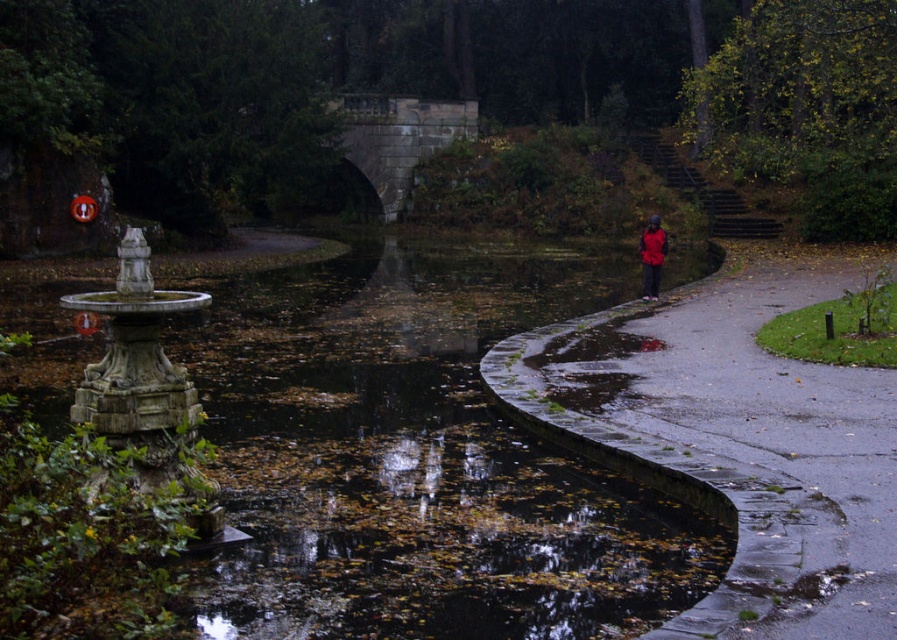
You are a delivery person carrying a package and need to walk along the smooth asphalt path at right while avoiding stepping on the red matte jacket at right. Can you safely walk on the path without stepping on the jacket?

The smooth asphalt path at right has a lesser height compared to the red matte jacket at right, so the jacket is elevated above the path. Therefore, you can safely walk on the path without stepping on the jacket.